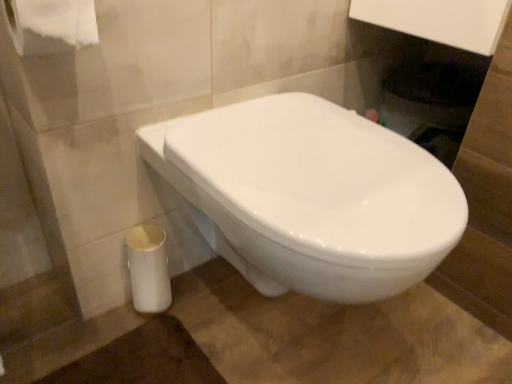
Question: Considering the relative sizes of white glossy trash can at lower left and white glossy toilet at center in the image provided, is white glossy trash can at lower left smaller than white glossy toilet at center?

Choices:
 (A) no
 (B) yes

Answer: (B)

Question: Is white glossy trash can at lower left closer to the viewer compared to white glossy toilet at center?

Choices:
 (A) no
 (B) yes

Answer: (A)

Question: Is white glossy trash can at lower left at the left side of white glossy toilet at center?

Choices:
 (A) yes
 (B) no

Answer: (A)

Question: Can you confirm if white glossy trash can at lower left is taller than white glossy toilet at center?

Choices:
 (A) no
 (B) yes

Answer: (A)

Question: Is white glossy trash can at lower left not within white glossy toilet at center?

Choices:
 (A) no
 (B) yes

Answer: (B)

Question: Which is correct: white paper at upper left is inside white glossy trash can at lower left, or outside of it?

Choices:
 (A) outside
 (B) inside

Answer: (A)

Question: From the image's perspective, is white paper at upper left positioned above or below white glossy trash can at lower left?

Choices:
 (A) above
 (B) below

Answer: (A)

Question: Considering the positions of white paper at upper left and white glossy trash can at lower left in the image, is white paper at upper left taller or shorter than white glossy trash can at lower left?

Choices:
 (A) short
 (B) tall

Answer: (A)

Question: In the image, is white paper at upper left positioned in front of or behind white glossy trash can at lower left?

Choices:
 (A) front
 (B) behind

Answer: (A)

Question: From the image's perspective, is white glossy toilet at center above or below white glossy trash can at lower left?

Choices:
 (A) above
 (B) below

Answer: (A)

Question: Is white glossy toilet at center spatially inside white glossy trash can at lower left, or outside of it?

Choices:
 (A) outside
 (B) inside

Answer: (A)

Question: Is white glossy toilet at center in front of or behind white glossy trash can at lower left in the image?

Choices:
 (A) front
 (B) behind

Answer: (A)

Question: Based on their sizes in the image, would you say white glossy toilet at center is bigger or smaller than white glossy trash can at lower left?

Choices:
 (A) big
 (B) small

Answer: (A)

Question: Visually, is white glossy trash can at lower left positioned to the left or to the right of white paper at upper left?

Choices:
 (A) left
 (B) right

Answer: (B)

Question: Is white glossy trash can at lower left wider or thinner than white paper at upper left?

Choices:
 (A) wide
 (B) thin

Answer: (B)